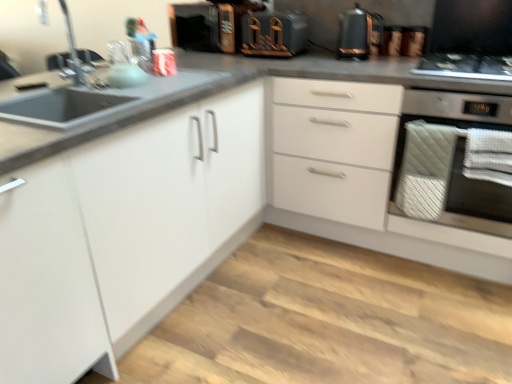
What is the approximate width of matte silver faucet at upper left?

matte silver faucet at upper left is 10.65 inches wide.

Find the location of a particular element. The width and height of the screenshot is (512, 384). wooden toaster at upper center is located at coordinates (273, 33).

Locate an element on the screen. The width and height of the screenshot is (512, 384). metallic copper kettle at upper right is located at coordinates tap(359, 33).

Does black glass gas stove at upper right have a larger size compared to metallic copper kettle at upper right?

Correct, black glass gas stove at upper right is larger in size than metallic copper kettle at upper right.

The image size is (512, 384). I want to click on kitchen appliance located on the left of black glass gas stove at upper right, so click(x=359, y=33).

Considering their positions, is black glass gas stove at upper right located in front of or behind metallic copper kettle at upper right?

Visually, black glass gas stove at upper right is located in front of metallic copper kettle at upper right.

Considering the relative positions of metallic copper kettle at upper right and matte silver faucet at upper left in the image provided, is metallic copper kettle at upper right to the left of matte silver faucet at upper left from the viewer's perspective?

In fact, metallic copper kettle at upper right is to the right of matte silver faucet at upper left.

From a real-world perspective, who is located lower, metallic copper kettle at upper right or matte silver faucet at upper left?

In real-world perspective, metallic copper kettle at upper right is lower.

From the image's perspective, is metallic copper kettle at upper right above matte silver faucet at upper left?

Yes, from the image's perspective, metallic copper kettle at upper right is on top of matte silver faucet at upper left.

Is wooden toaster at upper center oriented towards black glass gas stove at upper right?

No, wooden toaster at upper center does not turn towards black glass gas stove at upper right.

Consider the image. Can you confirm if wooden toaster at upper center is taller than black glass gas stove at upper right?

Yes, wooden toaster at upper center is taller than black glass gas stove at upper right.

Would you consider wooden toaster at upper center to be distant from black glass gas stove at upper right?

wooden toaster at upper center is actually quite close to black glass gas stove at upper right.

In order to click on gas stove that is on the right side of wooden toaster at upper center in this screenshot , I will do `click(466, 66)`.

Looking at this image, considering the relative positions of white quilted towel at right and matte silver faucet at upper left in the image provided, is white quilted towel at right in front of matte silver faucet at upper left?

No, white quilted towel at right is behind matte silver faucet at upper left.

Consider the image. From the image's perspective, is white quilted towel at right on matte silver faucet at upper left?

No.

Considering the sizes of objects white quilted towel at right and matte silver faucet at upper left in the image provided, who is taller, white quilted towel at right or matte silver faucet at upper left?

white quilted towel at right.

Does matte silver faucet at upper left have a lesser height compared to white matte cabinet at center?

Yes.

Is matte silver faucet at upper left bigger than white matte cabinet at center?

Actually, matte silver faucet at upper left might be smaller than white matte cabinet at center.

Would you say matte silver faucet at upper left is a long distance from white matte cabinet at center?

Indeed, matte silver faucet at upper left is not near white matte cabinet at center.

Which object is closer to the camera, matte silver faucet at upper left or white matte cabinet at center?

white matte cabinet at center is closer to the camera.

From a real-world perspective, is metallic copper kettle at upper right on black glass gas stove at upper right?

Yes, from a real-world perspective, metallic copper kettle at upper right is over black glass gas stove at upper right

From the image's perspective, which is below, metallic copper kettle at upper right or black glass gas stove at upper right?

black glass gas stove at upper right appears lower in the image.

Is black glass gas stove at upper right wider or thinner than wooden toaster at upper center?

Considering their sizes, black glass gas stove at upper right looks broader than wooden toaster at upper center.

From the image's perspective, is black glass gas stove at upper right above or below wooden toaster at upper center?

black glass gas stove at upper right is below wooden toaster at upper center.

Is black glass gas stove at upper right behind wooden toaster at upper center?

No, black glass gas stove at upper right is in front of wooden toaster at upper center.

At what (x,y) coordinates should I click in order to perform the action: click on gas stove lying in front of the metallic copper kettle at upper right. Please return your answer as a coordinate pair (x, y). Looking at the image, I should click on (466, 66).

Locate an element on the screen. This screenshot has width=512, height=384. kitchen appliance on the right of matte silver faucet at upper left is located at coordinates (359, 33).

Considering their positions, is black glass gas stove at upper right positioned closer to wooden toaster at upper center than matte silver faucet at upper left?

Based on the image, black glass gas stove at upper right appears to be nearer to wooden toaster at upper center.

Based on their spatial positions, is wooden toaster at upper center or white quilted towel at right further from black glass gas stove at upper right?

wooden toaster at upper center is positioned further to the anchor black glass gas stove at upper right.

Based on the photo, based on their spatial positions, is white quilted towel at right or wooden toaster at upper center closer to matte silver faucet at upper left?

Among the two, wooden toaster at upper center is located nearer to matte silver faucet at upper left.

From the image, which object appears to be farther from white quilted towel at right, wooden toaster at upper center or white matte cabinet at center?

Based on the image, white matte cabinet at center appears to be further to white quilted towel at right.

Based on their spatial positions, is white quilted towel at right or metallic copper kettle at upper right further from matte silver faucet at upper left?

Among the two, white quilted towel at right is located further to matte silver faucet at upper left.

Looking at the image, which one is located closer to wooden toaster at upper center, metallic copper kettle at upper right or matte silver faucet at upper left?

metallic copper kettle at upper right.

From the image, which object appears to be nearer to white quilted towel at right, matte silver faucet at upper left or metallic copper kettle at upper right?

Among the two, metallic copper kettle at upper right is located nearer to white quilted towel at right.

From the image, which object appears to be farther from white matte cabinet at center, black glass gas stove at upper right or white quilted towel at right?

black glass gas stove at upper right lies further to white matte cabinet at center than the other object.

The image size is (512, 384). Find the location of `gas stove situated between wooden toaster at upper center and white quilted towel at right from left to right`. gas stove situated between wooden toaster at upper center and white quilted towel at right from left to right is located at coordinates (466, 66).

This screenshot has width=512, height=384. In order to click on cabinetry situated between matte silver faucet at upper left and black glass gas stove at upper right from left to right in this screenshot , I will do `click(123, 233)`.

At what (x,y) coordinates should I click in order to perform the action: click on kitchen appliance between wooden toaster at upper center and black glass gas stove at upper right. Please return your answer as a coordinate pair (x, y). The width and height of the screenshot is (512, 384). Looking at the image, I should click on (359, 33).

You are a GUI agent. You are given a task and a screenshot of the screen. Output one action in this format:
    pyautogui.click(x=<x>, y=<y>)
    Task: Click on the appliance between matte silver faucet at upper left and black glass gas stove at upper right
    
    Given the screenshot: What is the action you would take?
    pyautogui.click(x=273, y=33)